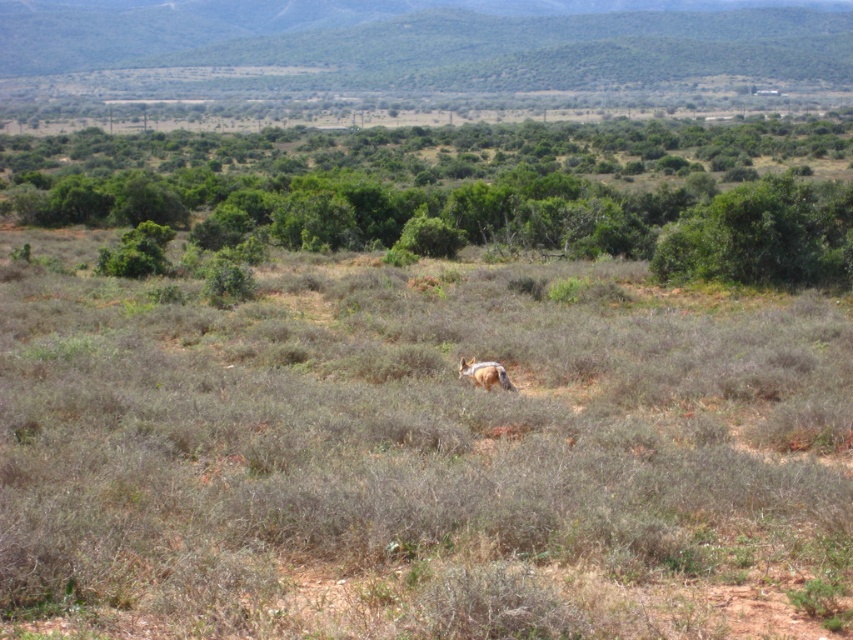
Question: Which of the following is the closest to the observer?

Choices:
 (A) (502, 387)
 (B) (469, 138)

Answer: (A)

Question: Which object is farther from the camera taking this photo?

Choices:
 (A) fur-like golden animal at center
 (B) green leafy shrubs at upper center

Answer: (B)

Question: Is green leafy shrubs at upper center wider than fur-like golden animal at center?

Choices:
 (A) yes
 (B) no

Answer: (A)

Question: Can you confirm if green leafy shrubs at upper center is positioned above fur-like golden animal at center?

Choices:
 (A) yes
 (B) no

Answer: (A)

Question: Observing the image, what is the correct spatial positioning of green leafy shrubs at upper center in reference to fur-like golden animal at center?

Choices:
 (A) below
 (B) above

Answer: (B)